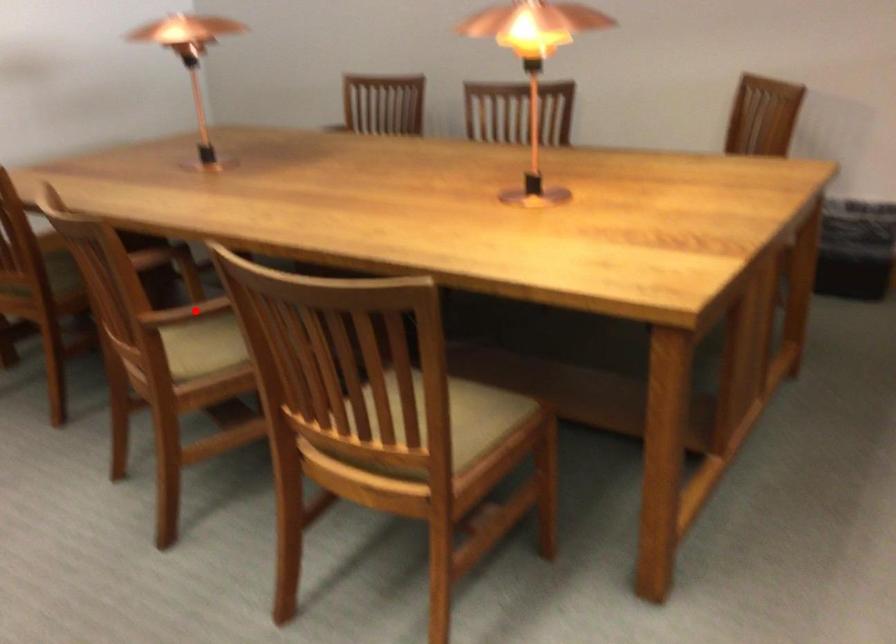
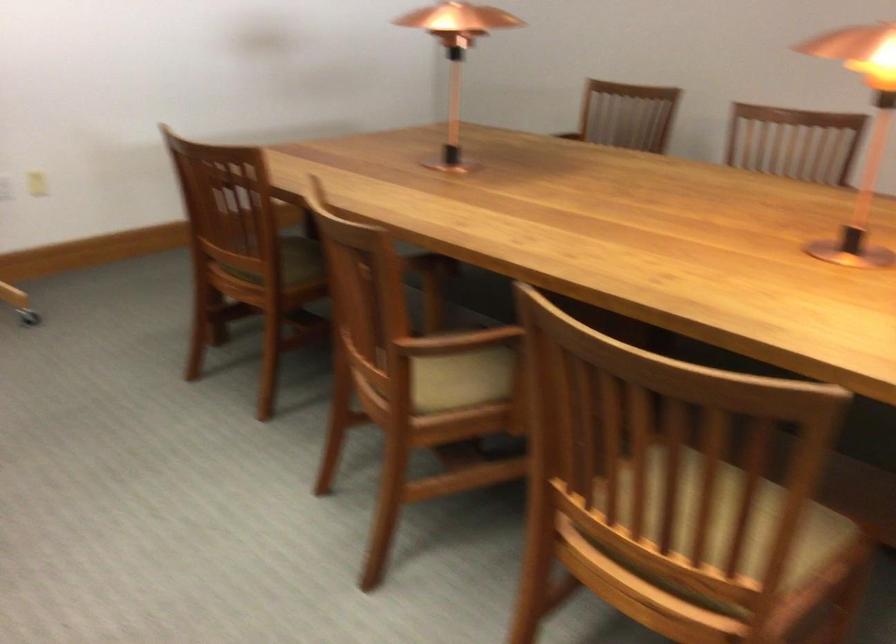
Question: I am providing you with two images of the same scene from different viewpoints. A red point is shown in image1. For the corresponding object point in image2, is it positioned nearer or farther from the camera?

Choices:
 (A) Nearer
 (B) Farther

Answer: (A)